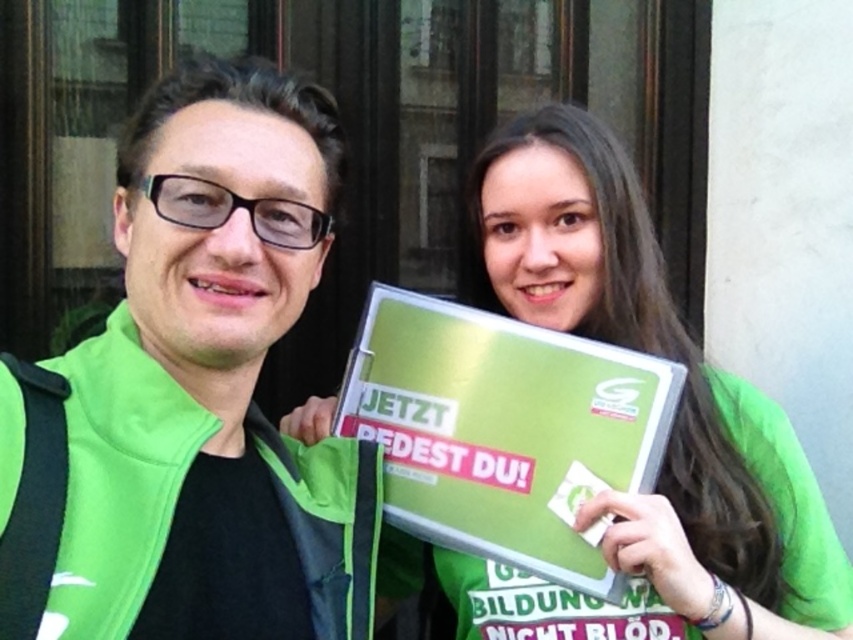
You are a photographer trying to capture both the green fabric jacket at left and the green matte sign at center in a single frame. Which object should you focus on first to ensure both are in the frame?

The green fabric jacket at left has a lesser height compared to the green matte sign at center, so you should focus on the taller green matte sign at center first to ensure both are in the frame.

Looking at this image, you are a photographer who needs to capture a clear shot of both the green fabric jacket at left and the green matte sign at center. Since you want to ensure both are visible, which object should you focus on first to avoid blurring? Please explain your reasoning based on their positions.

The green fabric jacket at left is positioned on the left side of the green matte sign at center. Since the jacket is closer to the camera than the sign, focusing on the jacket first would ensure it remains sharp while the sign might be slightly out of focus. However, if both need to be in focus, adjusting the focus point between them or using a smaller aperture would be better.

You are standing in front of the two people in the image. You need to reach a point that is exactly 1.33 meters away from you. Can you determine if the point at coordinates point (x=163, y=625) is at that distance?

The point at coordinates point (x=163, y=625) is exactly 1.33 meters away from the viewer, so yes, it is at the required distance.